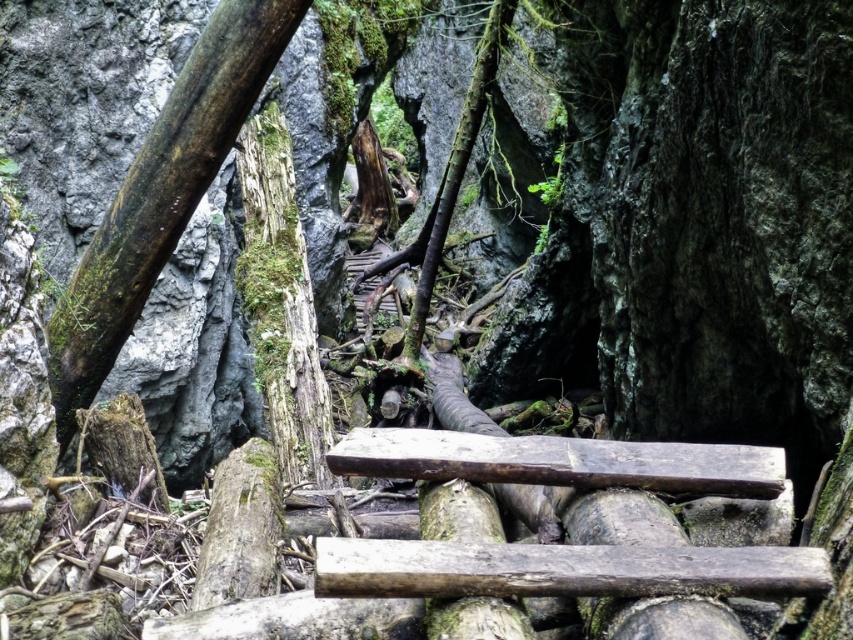
Question: Which point is farther from the camera taking this photo?

Choices:
 (A) (61, 358)
 (B) (637, 577)

Answer: (A)

Question: Is dark brown wood at left further to the viewer compared to brown rough wood at center?

Choices:
 (A) yes
 (B) no

Answer: (A)

Question: Considering the real-world distances, which object is closest to the brown rough wood at center?

Choices:
 (A) dark brown wood at left
 (B) dark brown rough log at center

Answer: (B)

Question: Observing the image, what is the correct spatial positioning of dark brown wood at left in reference to brown rough wood at center?

Choices:
 (A) left
 (B) right

Answer: (A)

Question: Is dark brown rough log at center closer to camera compared to brown rough wood at center?

Choices:
 (A) yes
 (B) no

Answer: (A)

Question: Among these points, which one is nearest to the camera?

Choices:
 (A) (431, 465)
 (B) (479, 593)
 (C) (64, 308)

Answer: (B)